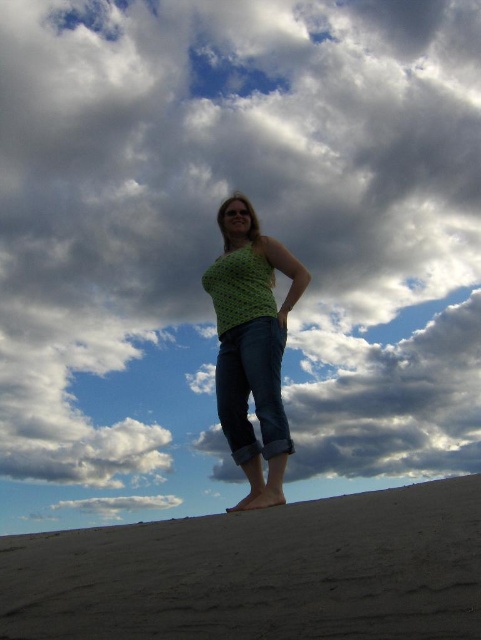
At what (x,y) coordinates should I click in order to perform the action: click on dark brown sand at lower center. Please return your answer as a coordinate pair (x, y). This screenshot has width=481, height=640. Looking at the image, I should click on (260, 572).

Is dark brown sand at lower center below green crochet tank top at center?

Indeed, dark brown sand at lower center is positioned under green crochet tank top at center.

Is point (186, 632) positioned after point (232, 445)?

No, (186, 632) is closer to viewer.

At what (x,y) coordinates should I click in order to perform the action: click on dark brown sand at lower center. Please return your answer as a coordinate pair (x, y). Image resolution: width=481 pixels, height=640 pixels. Looking at the image, I should click on (260, 572).

The image size is (481, 640). What do you see at coordinates (260, 572) in the screenshot?
I see `dark brown sand at lower center` at bounding box center [260, 572].

Is point (41, 612) positioned in front of point (242, 394)?

Yes, point (41, 612) is in front of point (242, 394).

At what (x,y) coordinates should I click in order to perform the action: click on dark brown sand at lower center. Please return your answer as a coordinate pair (x, y). The height and width of the screenshot is (640, 481). Looking at the image, I should click on [x=260, y=572].

Consider the image. Is green crochet tank top at center further to the viewer compared to denim at center?

No, green crochet tank top at center is closer to the viewer.

Locate an element on the screen. The height and width of the screenshot is (640, 481). green crochet tank top at center is located at coordinates (252, 346).